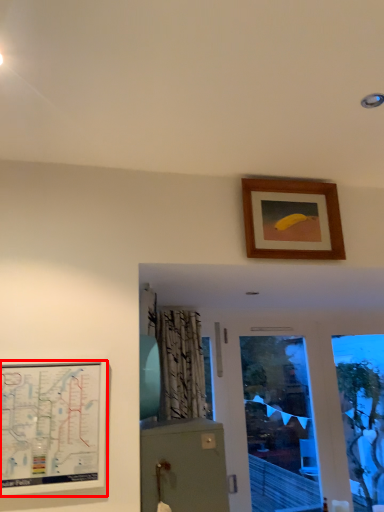
Question: From the image's perspective, considering the relative positions of picture frame (annotated by the red box) and picture frame in the image provided, where is picture frame (annotated by the red box) located with respect to the staircase?

Choices:
 (A) above
 (B) below

Answer: (B)